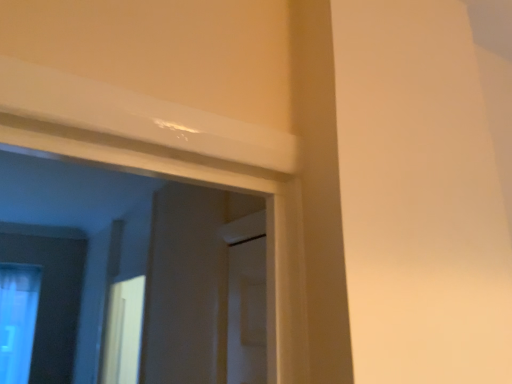
Describe the element at coordinates (17, 320) in the screenshot. This screenshot has height=384, width=512. I see `blue fabric curtain at lower left` at that location.

You are a GUI agent. You are given a task and a screenshot of the screen. Output one action in this format:
    pyautogui.click(x=<x>, y=<y>)
    Task: Click on the blue fabric curtain at lower left
    
    Given the screenshot: What is the action you would take?
    pyautogui.click(x=17, y=320)

Identify the location of blue fabric curtain at lower left. (17, 320).